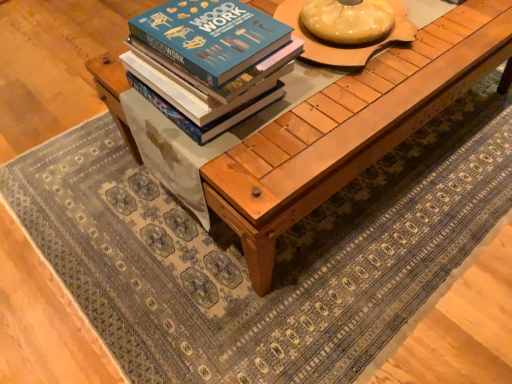
Question: From the image's perspective, would you say blue matte book at center is positioned over matte wooden round table at center?

Choices:
 (A) yes
 (B) no

Answer: (B)

Question: Considering the relative sizes of blue matte book at center and matte wooden round table at center in the image provided, is blue matte book at center thinner than matte wooden round table at center?

Choices:
 (A) yes
 (B) no

Answer: (A)

Question: Does blue matte book at center appear on the left side of matte wooden round table at center?

Choices:
 (A) no
 (B) yes

Answer: (B)

Question: From the image's perspective, does blue matte book at center appear lower than matte wooden round table at center?

Choices:
 (A) no
 (B) yes

Answer: (B)

Question: Is blue matte book at center positioned in front of matte wooden round table at center?

Choices:
 (A) no
 (B) yes

Answer: (B)

Question: Is blue matte book at center beside matte wooden round table at center?

Choices:
 (A) yes
 (B) no

Answer: (B)

Question: From the image's perspective, would you say matte wooden round table at center is positioned over natural wood table at center?

Choices:
 (A) no
 (B) yes

Answer: (B)

Question: Can we say matte wooden round table at center lies outside natural wood table at center?

Choices:
 (A) yes
 (B) no

Answer: (A)

Question: Does matte wooden round table at center come behind natural wood table at center?

Choices:
 (A) yes
 (B) no

Answer: (A)

Question: Is matte wooden round table at center positioned in front of natural wood table at center?

Choices:
 (A) yes
 (B) no

Answer: (B)

Question: From the image's perspective, is matte wooden round table at center located beneath natural wood table at center?

Choices:
 (A) yes
 (B) no

Answer: (B)

Question: Is matte wooden round table at center smaller than natural wood table at center?

Choices:
 (A) yes
 (B) no

Answer: (A)

Question: Considering the relative sizes of natural wood table at center and blue matte book at center in the image provided, is natural wood table at center smaller than blue matte book at center?

Choices:
 (A) yes
 (B) no

Answer: (B)